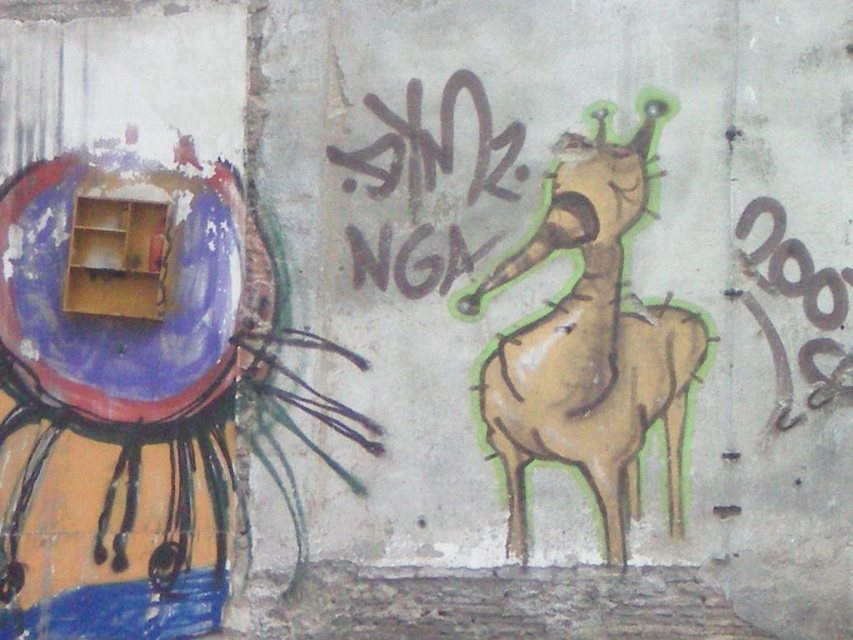
You are standing at point A, which is at coordinates point A at (648, 400). You want to walk to point B, which is at coordinates point B at 0.453, 0.321. The path between them is a straight line. Can you safely walk this path without crossing any obstacles?

The distance between point A at (648, 400) and point B at 0.453, 0.321 is 7.78 meters. Since there are no obstacles mentioned in the scene description, you can safely walk the straight path between them.

You are an artist planning to add a new mural element above the existing black graffiti at center. Based on the scene, where should you place the new element to ensure it doesn not overlap with the beige textured giraffe at center?

The beige textured giraffe at center is located below the black graffiti at center. Therefore, placing the new element above the black graffiti at center would keep it above the giraffe, avoiding overlap.